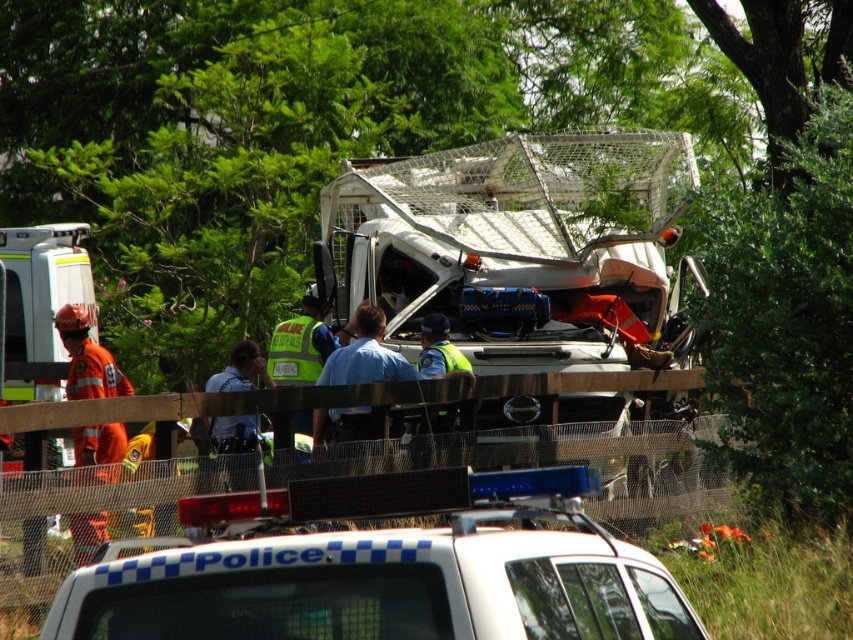
Question: Is the position of orange reflective uniform at left less distant than that of reflective yellow vest at center?

Choices:
 (A) no
 (B) yes

Answer: (A)

Question: Can you confirm if white plastic police car at center is wider than orange reflective uniform at left?

Choices:
 (A) yes
 (B) no

Answer: (A)

Question: Considering the real-world distances, which object is farthest from the orange reflective uniform at left?

Choices:
 (A) reflective yellow vest at center
 (B) white plastic police car at center

Answer: (B)

Question: Which point appears farthest from the camera in this image?

Choices:
 (A) (88, 458)
 (B) (230, 444)

Answer: (A)

Question: Which object appears closest to the camera in this image?

Choices:
 (A) reflective yellow vest at center
 (B) white plastic police car at center

Answer: (B)

Question: Considering the relative positions of white plastic police car at center and orange reflective uniform at left in the image provided, where is white plastic police car at center located with respect to orange reflective uniform at left?

Choices:
 (A) below
 (B) above

Answer: (A)